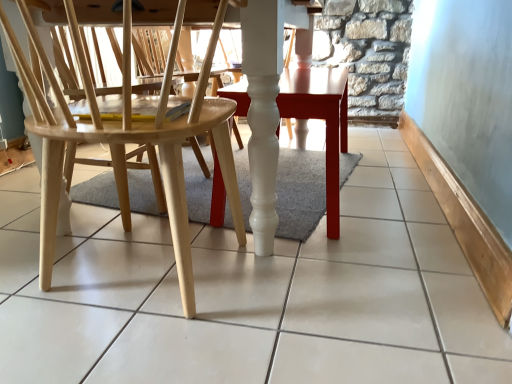
Question: Is natural wood chair at left located within white glossy table at center?

Choices:
 (A) yes
 (B) no

Answer: (B)

Question: Is white glossy table at center positioned with its back to natural wood chair at left?

Choices:
 (A) no
 (B) yes

Answer: (A)

Question: Considering the relative positions of white glossy table at center and natural wood chair at left in the image provided, is white glossy table at center in front of natural wood chair at left?

Choices:
 (A) no
 (B) yes

Answer: (A)

Question: From the image's perspective, is white glossy table at center beneath natural wood chair at left?

Choices:
 (A) yes
 (B) no

Answer: (B)

Question: Does white glossy table at center have a lesser height compared to natural wood chair at left?

Choices:
 (A) no
 (B) yes

Answer: (B)

Question: From the image's perspective, is white glossy table at center located above natural wood chair at left?

Choices:
 (A) no
 (B) yes

Answer: (B)

Question: Is natural wood chair at left facing away from white glossy table at center?

Choices:
 (A) yes
 (B) no

Answer: (A)

Question: From the image's perspective, is natural wood chair at left over white glossy table at center?

Choices:
 (A) yes
 (B) no

Answer: (B)

Question: Does natural wood chair at left appear on the right side of white glossy table at center?

Choices:
 (A) no
 (B) yes

Answer: (A)

Question: From a real-world perspective, is natural wood chair at left below white glossy table at center?

Choices:
 (A) yes
 (B) no

Answer: (B)

Question: From a real-world perspective, is natural wood chair at left located higher than white glossy table at center?

Choices:
 (A) yes
 (B) no

Answer: (A)

Question: Is natural wood chair at left located outside white glossy table at center?

Choices:
 (A) yes
 (B) no

Answer: (A)

Question: Is white glossy table at center bigger or smaller than natural wood chair at left?

Choices:
 (A) big
 (B) small

Answer: (B)